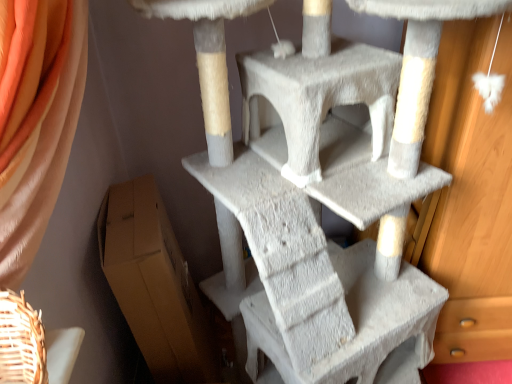
I want to click on brown cardboard box at lower left, so click(x=154, y=284).

The height and width of the screenshot is (384, 512). Describe the element at coordinates (154, 284) in the screenshot. I see `brown cardboard box at lower left` at that location.

What is the approximate width of brown cardboard box at lower left?

brown cardboard box at lower left is 15.01 inches in width.

What is the approximate height of brown cardboard box at lower left?

The height of brown cardboard box at lower left is 81.29 centimeters.

From the picture: What is the approximate height of white textured cat tree at center?

white textured cat tree at center is 4.74 feet in height.

This screenshot has width=512, height=384. Find the location of `white textured cat tree at center`. white textured cat tree at center is located at coordinates (316, 165).

This screenshot has width=512, height=384. Describe the element at coordinates (316, 165) in the screenshot. I see `white textured cat tree at center` at that location.

Identify the location of brown cardboard box at lower left. (154, 284).

Can you confirm if brown cardboard box at lower left is positioned to the left of white textured cat tree at center?

Correct, you'll find brown cardboard box at lower left to the left of white textured cat tree at center.

Is brown cardboard box at lower left further to the viewer compared to white textured cat tree at center?

That is True.

Between point (166, 244) and point (335, 146), which one is positioned behind?

The point (166, 244) is more distant.

From the image's perspective, is brown cardboard box at lower left on top of white textured cat tree at center?

No.

From a real-world perspective, which object rests below the other?

brown cardboard box at lower left, from a real-world perspective.

Which of these two, brown cardboard box at lower left or white textured cat tree at center, is wider?

white textured cat tree at center.

Between brown cardboard box at lower left and white textured cat tree at center, which one has less height?

brown cardboard box at lower left.

Can you confirm if brown cardboard box at lower left is bigger than white textured cat tree at center?

Actually, brown cardboard box at lower left might be smaller than white textured cat tree at center.

Is white textured cat tree at center a part of brown cardboard box at lower left?

That's incorrect, white textured cat tree at center is not inside brown cardboard box at lower left.

Is brown cardboard box at lower left beside white textured cat tree at center?

There is a gap between brown cardboard box at lower left and white textured cat tree at center.

Does brown cardboard box at lower left turn towards white textured cat tree at center?

Yes, brown cardboard box at lower left is turned towards white textured cat tree at center.

You are a GUI agent. You are given a task and a screenshot of the screen. Output one action in this format:
    pyautogui.click(x=<x>, y=<y>)
    Task: Click on the cardboard box that appears below the white textured cat tree at center (from a real-world perspective)
    The image size is (512, 384).
    Given the screenshot: What is the action you would take?
    pyautogui.click(x=154, y=284)

Considering the positions of objects white textured cat tree at center and brown cardboard box at lower left in the image provided, who is more to the right, white textured cat tree at center or brown cardboard box at lower left?

From the viewer's perspective, white textured cat tree at center appears more on the right side.

Does white textured cat tree at center come in front of brown cardboard box at lower left?

Yes, white textured cat tree at center is closer to the viewer.

Considering the points (218, 31) and (172, 275), which point is in front, point (218, 31) or point (172, 275)?

The point (218, 31) is more forward.

From the image's perspective, which is above, white textured cat tree at center or brown cardboard box at lower left?

white textured cat tree at center, from the image's perspective.

From a real-world perspective, which object rests below the other?

brown cardboard box at lower left, from a real-world perspective.

Is white textured cat tree at center wider or thinner than brown cardboard box at lower left?

Clearly, white textured cat tree at center has more width compared to brown cardboard box at lower left.

Does white textured cat tree at center have a lesser height compared to brown cardboard box at lower left?

No.

Which of these two, white textured cat tree at center or brown cardboard box at lower left, is smaller?

Smaller between the two is brown cardboard box at lower left.

Is brown cardboard box at lower left surrounded by white textured cat tree at center?

No, brown cardboard box at lower left is located outside of white textured cat tree at center.

Is white textured cat tree at center positioned far away from brown cardboard box at lower left?

Actually, white textured cat tree at center and brown cardboard box at lower left are a little close together.

Is white textured cat tree at center looking in the opposite direction of brown cardboard box at lower left?

Yes, white textured cat tree at center's orientation is away from brown cardboard box at lower left.

The width and height of the screenshot is (512, 384). In order to click on cardboard box below the white textured cat tree at center (from the image's perspective) in this screenshot , I will do `click(154, 284)`.

Find the location of a particular element. cardboard box behind the white textured cat tree at center is located at coordinates (154, 284).

Locate an element on the screen. The width and height of the screenshot is (512, 384). furniture positioned vertically above the brown cardboard box at lower left (from a real-world perspective) is located at coordinates pyautogui.click(x=316, y=165).